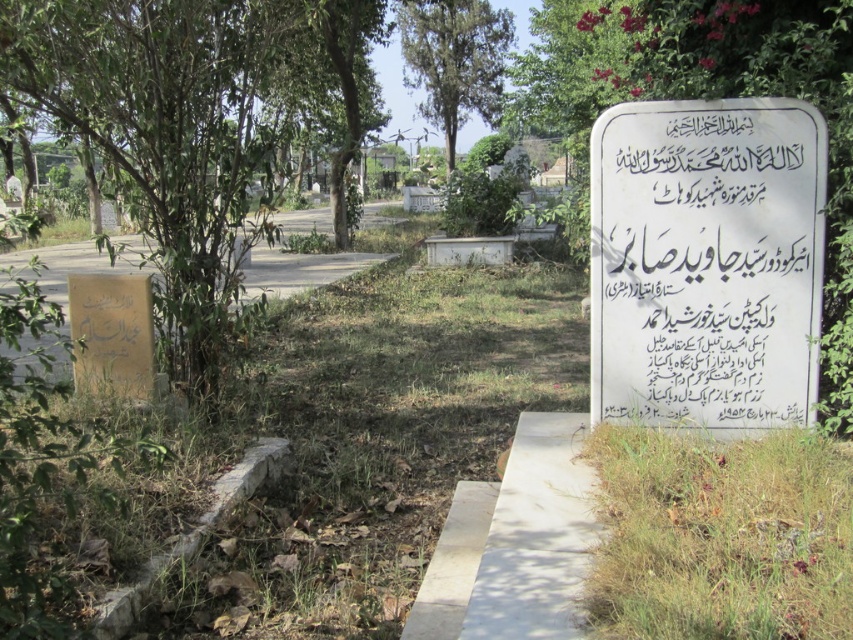
Does white paper sign at upper right have a larger size compared to green grass at lower right?

No, white paper sign at upper right is not bigger than green grass at lower right.

Can you confirm if white paper sign at upper right is positioned to the right of green grass at lower right?

Yes, white paper sign at upper right is to the right of green grass at lower right.

Does point (699, 310) lie behind point (602, 625)?

Yes, point (699, 310) is farther from viewer.

Where is `white paper sign at upper right`? The height and width of the screenshot is (640, 853). white paper sign at upper right is located at coordinates (706, 262).

Does green leafy tree at upper center have a greater height compared to yellow stone path at left?

Correct, green leafy tree at upper center is much taller as yellow stone path at left.

Between point (418, 83) and point (370, 252), which one is positioned in front?

Point (370, 252)

You are a GUI agent. You are given a task and a screenshot of the screen. Output one action in this format:
    pyautogui.click(x=<x>, y=<y>)
    Task: Click on the green leafy tree at upper center
    Image resolution: width=853 pixels, height=640 pixels.
    Given the screenshot: What is the action you would take?
    pyautogui.click(x=454, y=60)

Identify the location of green leafy tree at left. pos(171,132).

What do you see at coordinates (171, 132) in the screenshot?
I see `green leafy tree at left` at bounding box center [171, 132].

Locate an element on the screen. green leafy tree at left is located at coordinates (171, 132).